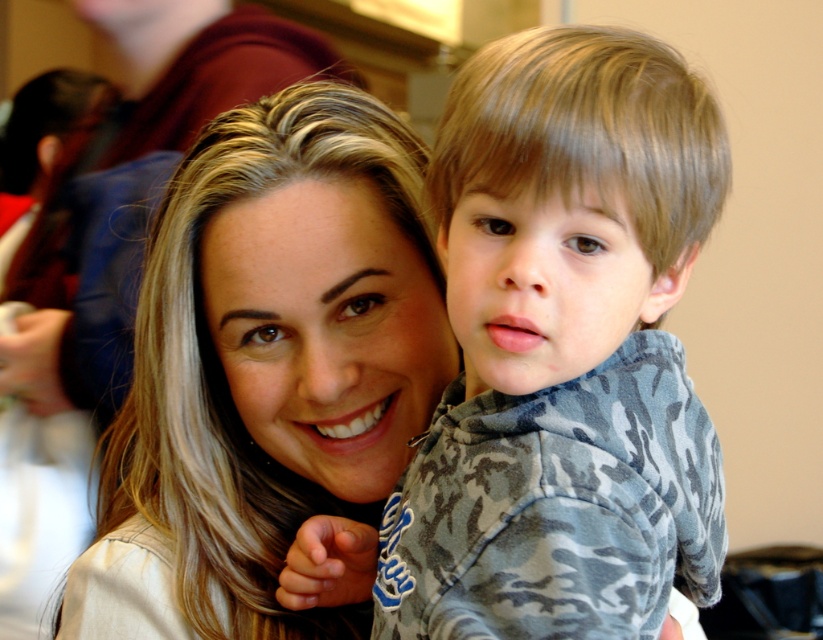
This screenshot has width=823, height=640. What do you see at coordinates (563, 352) in the screenshot?
I see `camouflage fleece at center` at bounding box center [563, 352].

Locate an element on the screen. This screenshot has width=823, height=640. camouflage fleece at center is located at coordinates (563, 352).